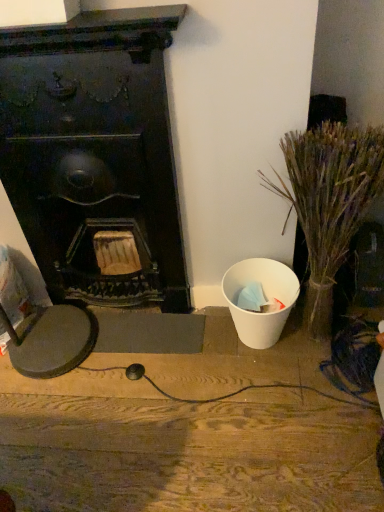
Question: Considering the relative sizes of black matte fireplace at left and dry grass at right in the image provided, is black matte fireplace at left shorter than dry grass at right?

Choices:
 (A) no
 (B) yes

Answer: (A)

Question: Is black matte fireplace at left smaller than dry grass at right?

Choices:
 (A) no
 (B) yes

Answer: (A)

Question: Is black matte fireplace at left with dry grass at right?

Choices:
 (A) yes
 (B) no

Answer: (B)

Question: Can you confirm if black matte fireplace at left is thinner than dry grass at right?

Choices:
 (A) yes
 (B) no

Answer: (A)

Question: Can you confirm if black matte fireplace at left is wider than dry grass at right?

Choices:
 (A) no
 (B) yes

Answer: (A)

Question: From the image's perspective, relative to white matte trash can at right, is dry grass at right above or below?

Choices:
 (A) below
 (B) above

Answer: (B)

Question: From a real-world perspective, is dry grass at right above or below white matte trash can at right?

Choices:
 (A) above
 (B) below

Answer: (A)

Question: Relative to white matte trash can at right, is dry grass at right in front or behind?

Choices:
 (A) front
 (B) behind

Answer: (A)

Question: Based on their sizes in the image, would you say dry grass at right is bigger or smaller than white matte trash can at right?

Choices:
 (A) small
 (B) big

Answer: (B)

Question: In terms of size, does dry grass at right appear bigger or smaller than black matte fireplace at left?

Choices:
 (A) big
 (B) small

Answer: (B)

Question: From a real-world perspective, is dry grass at right physically located above or below black matte fireplace at left?

Choices:
 (A) below
 (B) above

Answer: (A)

Question: Is point (352, 158) positioned closer to the camera than point (145, 50)?

Choices:
 (A) farther
 (B) closer

Answer: (B)

Question: From the image's perspective, is dry grass at right positioned above or below black matte fireplace at left?

Choices:
 (A) below
 (B) above

Answer: (A)

Question: From a real-world perspective, relative to dry grass at right, is white matte trash can at right vertically above or below?

Choices:
 (A) above
 (B) below

Answer: (B)

Question: Considering the positions of white matte trash can at right and dry grass at right in the image, is white matte trash can at right bigger or smaller than dry grass at right?

Choices:
 (A) small
 (B) big

Answer: (A)